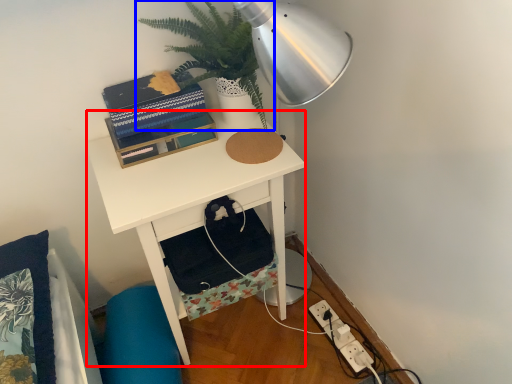
Question: Among these objects, which one is nearest to the camera, desk (highlighted by a red box) or houseplant (highlighted by a blue box)?

Choices:
 (A) desk
 (B) houseplant

Answer: (B)